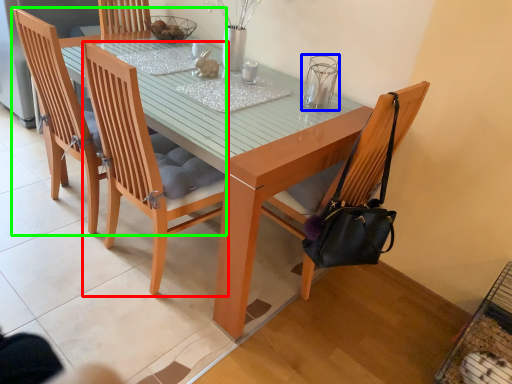
Question: Considering the real-world distances, which object is closest to chair (highlighted by a red box)? clear (highlighted by a blue box) or chair (highlighted by a green box).

Choices:
 (A) clear
 (B) chair

Answer: (B)